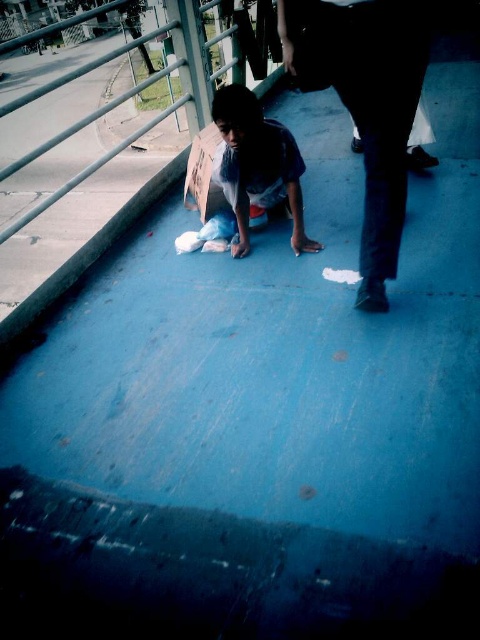
You are a photographer trying to capture a candid shot of two people sitting at the center of the walkway. According to the scene, which of the two individuals wearing dark fabric pants at center and blue denim jeans at center is sitting to the right?

The dark fabric pants at center is positioned on the right side of blue denim jeans at center, so the person wearing dark fabric pants at center is sitting to the right.

You are a photographer taking a picture of two people at the center of the walkway. The subjects are wearing dark fabric pants at center and blue denim jeans at center. Based on the scene description, which pair of pants would appear narrower in the photo?

The dark fabric pants at center would appear narrower in the photo since it is thinner than the blue denim jeans at center.

You are a photographer trying to capture a candid shot of the two people at the center of the scene. Since you want to ensure both subjects are in focus, you need to know which one is taller. According to the scene, which of the two, the dark fabric pants at center or the blue denim jeans at center, is taller?

The dark fabric pants at center is much taller than the blue denim jeans at center, so you should focus on the dark fabric pants at center first as it is the taller one.